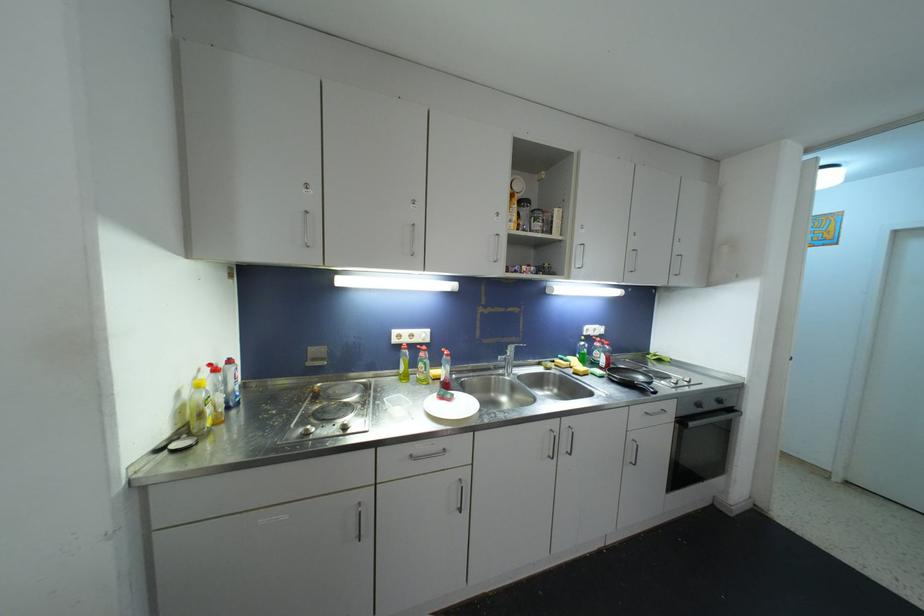
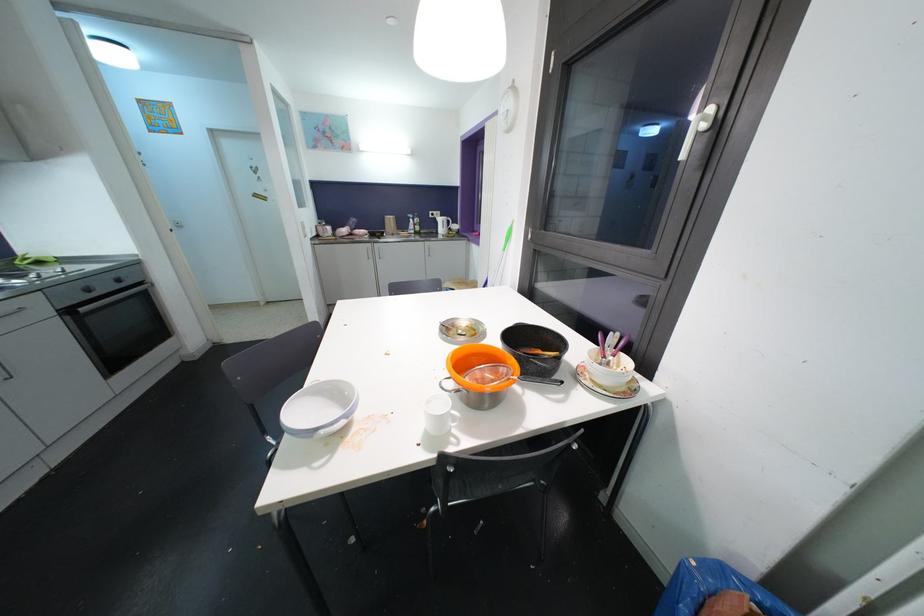
The point at [695,427] is marked in the first image. Where is the corresponding point in the second image?

(84, 312)